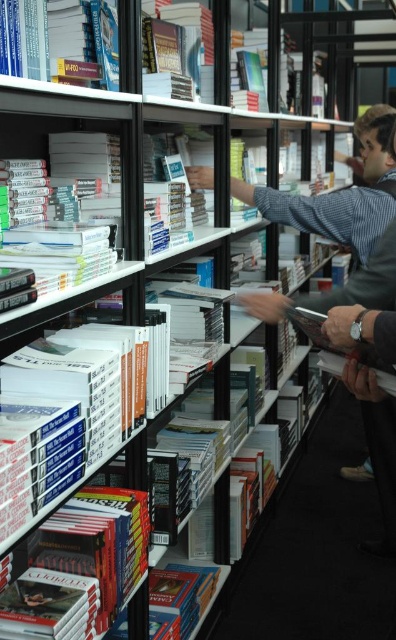
From the picture: Between hardcover book at upper left and hardcover book at upper center, which one has less height?

With less height is hardcover book at upper left.

Consider the image. Can you confirm if hardcover book at upper left is positioned to the left of hardcover book at upper center?

Yes, hardcover book at upper left is to the left of hardcover book at upper center.

Locate an element on the screen. hardcover book at upper left is located at coordinates (59, 36).

Can you confirm if hardcover book at upper center is smaller than hardcover book at center?

Indeed, hardcover book at upper center has a smaller size compared to hardcover book at center.

Does hardcover book at upper center appear on the right side of hardcover book at center?

Correct, you'll find hardcover book at upper center to the right of hardcover book at center.

Between point (152, 49) and point (171, 180), which one is positioned behind?

Positioned behind is point (171, 180).

Identify the location of hardcover book at upper center. The image size is (396, 640). (177, 51).

Is hardcover book at lower left closer to camera compared to hardcover book at upper left?

No, hardcover book at lower left is behind hardcover book at upper left.

Image resolution: width=396 pixels, height=640 pixels. Identify the location of hardcover book at lower left. (97, 544).